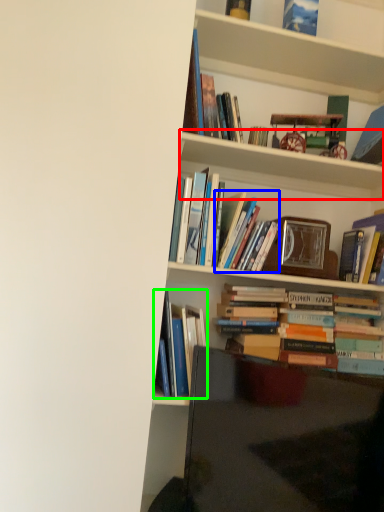
Question: Based on their relative distances, which object is nearer to cabinet (highlighted by a red box)? Choose from book (highlighted by a blue box) and book (highlighted by a green box).

Choices:
 (A) book
 (B) book

Answer: (A)